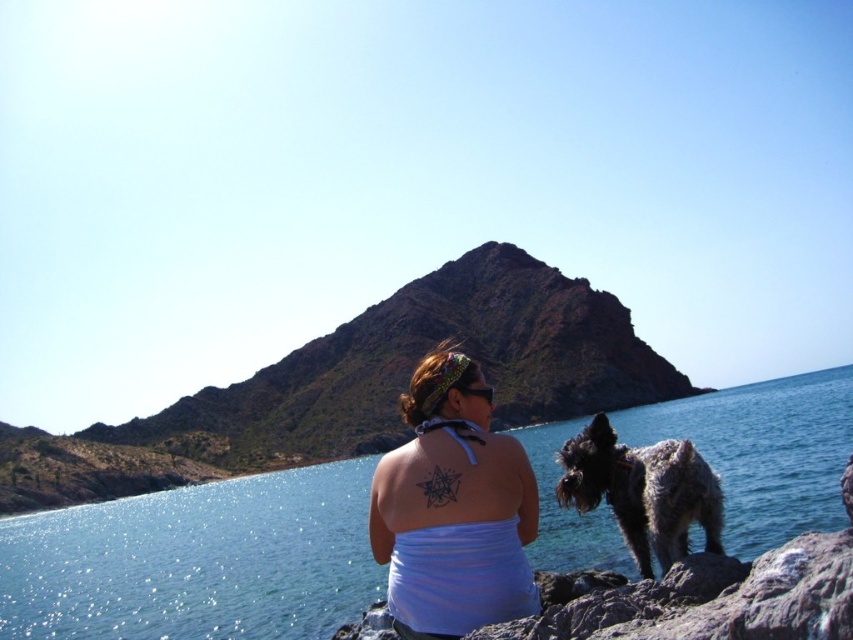
Who is lower down, white matte tank top at center or spotted fur dog at lower right?

spotted fur dog at lower right is below.

Which of these two, white matte tank top at center or spotted fur dog at lower right, stands taller?

white matte tank top at center is taller.

Is point (483, 435) less distant than point (596, 428)?

That is True.

The image size is (853, 640). I want to click on white matte tank top at center, so pyautogui.click(x=453, y=508).

In the scene shown: Measure the distance between blue liquid water at center and white matte tank top at center.

A distance of 53.54 meters exists between blue liquid water at center and white matte tank top at center.

Is blue liquid water at center to the left of white matte tank top at center from the viewer's perspective?

In fact, blue liquid water at center is to the right of white matte tank top at center.

Between point (831, 474) and point (476, 563), which one is positioned behind?

Point (831, 474)

Locate an element on the screen. blue liquid water at center is located at coordinates (196, 561).

Is blue liquid water at center to the left of spotted fur dog at lower right from the viewer's perspective?

Incorrect, blue liquid water at center is not on the left side of spotted fur dog at lower right.

In the scene shown: Can you confirm if blue liquid water at center is taller than spotted fur dog at lower right?

Correct, blue liquid water at center is much taller as spotted fur dog at lower right.

At what (x,y) coordinates should I click in order to perform the action: click on blue liquid water at center. Please return your answer as a coordinate pair (x, y). The image size is (853, 640). Looking at the image, I should click on (196, 561).